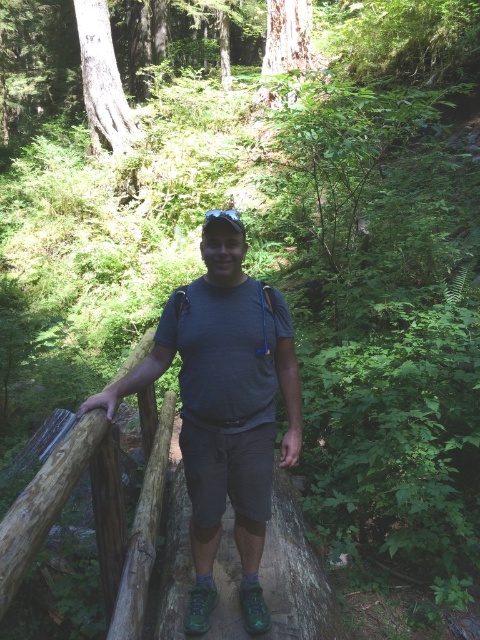
You are standing on the wooden bridge in the forest and want to know which of the two points, point [233,529] or point [215,611], is closer to you. Which one is closer?

Point [233,529] is further to the viewer than point [215,611], so the closer point to you is point [215,611].